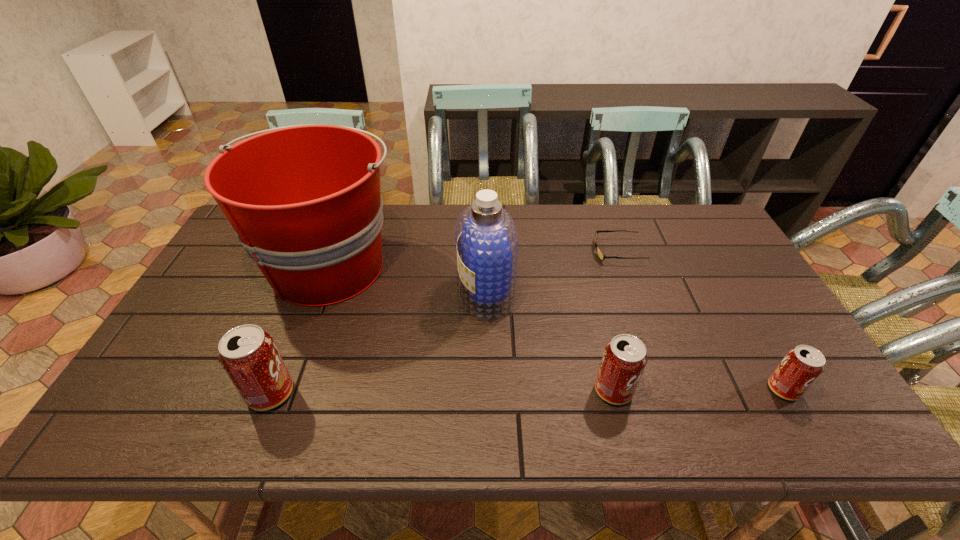
Identify the location of the leftmost soda can. This screenshot has width=960, height=540. (248, 354).

The width and height of the screenshot is (960, 540). Identify the location of the fourth shortest object. (248, 354).

This screenshot has width=960, height=540. Find the location of `the second shortest soda can`. the second shortest soda can is located at coordinates (624, 359).

You are a GUI agent. You are given a task and a screenshot of the screen. Output one action in this format:
    pyautogui.click(x=<x>, y=<y>)
    Task: Click on the fourth tallest object
    
    Given the screenshot: What is the action you would take?
    pyautogui.click(x=624, y=359)

I want to click on the rightmost object, so click(x=801, y=366).

You are a GUI agent. You are given a task and a screenshot of the screen. Output one action in this format:
    pyautogui.click(x=<x>, y=<y>)
    Task: Click on the rightmost soda can
    The width and height of the screenshot is (960, 540).
    Given the screenshot: What is the action you would take?
    pyautogui.click(x=801, y=366)

Locate an element on the screen. the fifth object from left to right is located at coordinates (601, 255).

I want to click on sunglasses, so click(601, 255).

You are a GUI agent. You are given a task and a screenshot of the screen. Output one action in this format:
    pyautogui.click(x=<x>, y=<y>)
    Task: Click on the bucket
    The image size is (960, 540).
    Given the screenshot: What is the action you would take?
    pyautogui.click(x=304, y=200)

Where is `cleansing agent`? The width and height of the screenshot is (960, 540). cleansing agent is located at coordinates (486, 238).